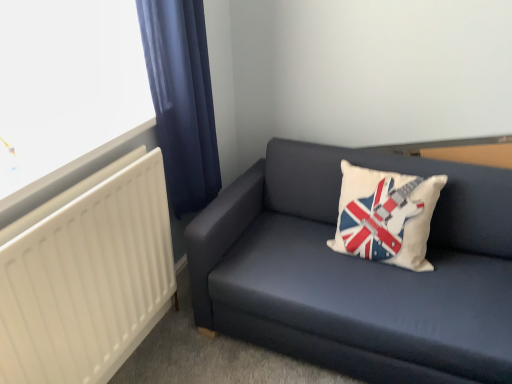
Question: Is dark blue fabric couch at lower right a part of dark blue fabric curtain at left?

Choices:
 (A) yes
 (B) no

Answer: (B)

Question: Does dark blue fabric curtain at left appear on the left side of dark blue fabric couch at lower right?

Choices:
 (A) yes
 (B) no

Answer: (A)

Question: Considering the relative positions of dark blue fabric curtain at left and dark blue fabric couch at lower right in the image provided, is dark blue fabric curtain at left to the right of dark blue fabric couch at lower right from the viewer's perspective?

Choices:
 (A) no
 (B) yes

Answer: (A)

Question: Is dark blue fabric curtain at left aimed at dark blue fabric couch at lower right?

Choices:
 (A) no
 (B) yes

Answer: (B)

Question: Is the depth of dark blue fabric curtain at left less than that of dark blue fabric couch at lower right?

Choices:
 (A) yes
 (B) no

Answer: (B)

Question: In the image, is white matte radiator at left positioned in front of or behind dark blue fabric curtain at left?

Choices:
 (A) front
 (B) behind

Answer: (A)

Question: Is white matte radiator at left bigger or smaller than dark blue fabric curtain at left?

Choices:
 (A) big
 (B) small

Answer: (A)

Question: Does point (30, 246) appear closer or farther from the camera than point (167, 29)?

Choices:
 (A) farther
 (B) closer

Answer: (B)

Question: Is white matte radiator at left spatially inside dark blue fabric curtain at left, or outside of it?

Choices:
 (A) outside
 (B) inside

Answer: (A)

Question: Looking at their shapes, would you say dark blue fabric couch at lower right is wider or thinner than white fabric pillow with union jack design at center?

Choices:
 (A) wide
 (B) thin

Answer: (A)

Question: Considering the positions of dark blue fabric couch at lower right and white fabric pillow with union jack design at center in the image, is dark blue fabric couch at lower right taller or shorter than white fabric pillow with union jack design at center?

Choices:
 (A) short
 (B) tall

Answer: (B)

Question: Based on their sizes in the image, would you say dark blue fabric couch at lower right is bigger or smaller than white fabric pillow with union jack design at center?

Choices:
 (A) small
 (B) big

Answer: (B)

Question: Is dark blue fabric couch at lower right situated inside white fabric pillow with union jack design at center or outside?

Choices:
 (A) inside
 (B) outside

Answer: (B)

Question: Does point (16, 370) appear closer or farther from the camera than point (421, 183)?

Choices:
 (A) farther
 (B) closer

Answer: (B)

Question: From a real-world perspective, relative to white fabric pillow with union jack design at center, is white matte radiator at left vertically above or below?

Choices:
 (A) above
 (B) below

Answer: (B)